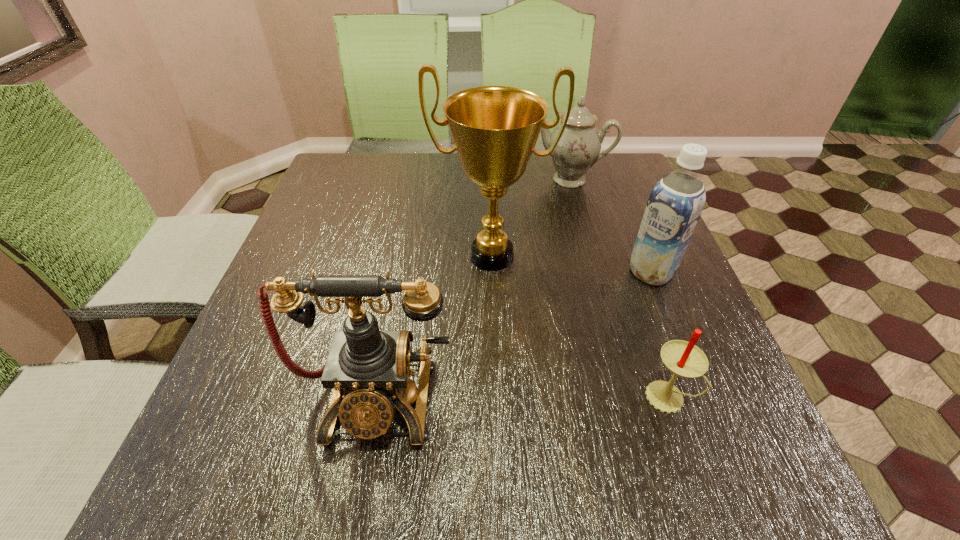
Where is `vacant region located 0.210m on the front view with handles of the tallest object`? vacant region located 0.210m on the front view with handles of the tallest object is located at coordinates (484, 366).

Find the location of a particular element. The image size is (960, 540). vacant space located 0.220m on the front view with handles of the tallest object is located at coordinates (484, 370).

Locate an element on the screen. The height and width of the screenshot is (540, 960). vacant point located on the front view with handles of the tallest object is located at coordinates (484, 366).

Where is `vacant space located on the label of the soya milk`? Image resolution: width=960 pixels, height=540 pixels. vacant space located on the label of the soya milk is located at coordinates (607, 309).

At what (x,y) coordinates should I click in order to perform the action: click on blank area located on the label of the soya milk. Please return your answer as a coordinate pair (x, y). The width and height of the screenshot is (960, 540). Looking at the image, I should click on (518, 382).

Locate an element on the screen. This screenshot has height=540, width=960. free location located 0.090m on the label of the soya milk is located at coordinates (612, 304).

Locate an element on the screen. This screenshot has height=540, width=960. object that is at the far edge is located at coordinates (578, 149).

I want to click on telephone located at the near edge, so [368, 368].

Find the location of a particular element. candle located at the near edge is located at coordinates (684, 359).

The width and height of the screenshot is (960, 540). Identify the location of object located at the left edge. (368, 368).